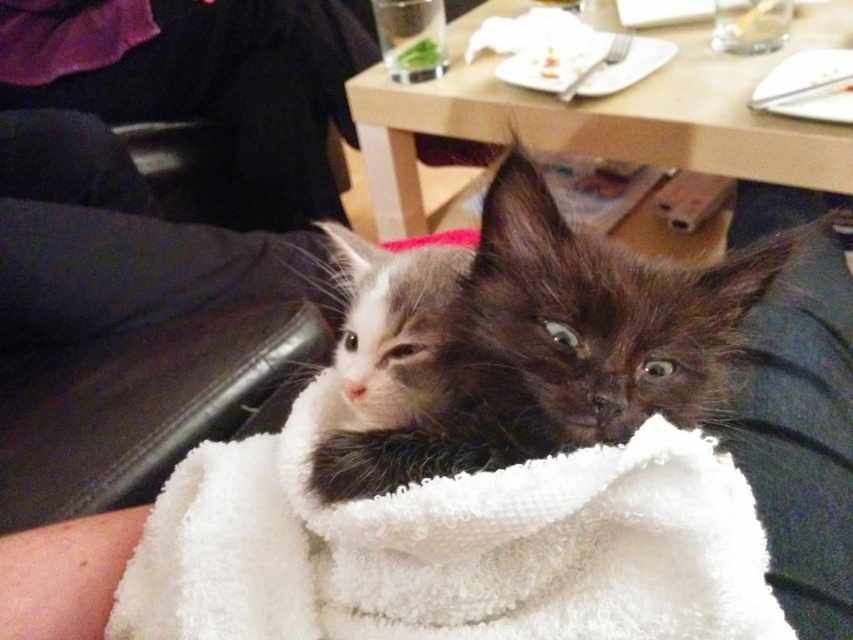
Who is positioned more to the right, white fluffy blanket at center or fluffy brown kitten at center?

Positioned to the right is fluffy brown kitten at center.

Does white fluffy blanket at center appear on the left side of fluffy brown kitten at center?

Yes, white fluffy blanket at center is to the left of fluffy brown kitten at center.

Which is in front, point (207, 442) or point (563, 353)?

Positioned in front is point (563, 353).

Find the location of a particular element. This screenshot has width=853, height=640. white fluffy blanket at center is located at coordinates (451, 547).